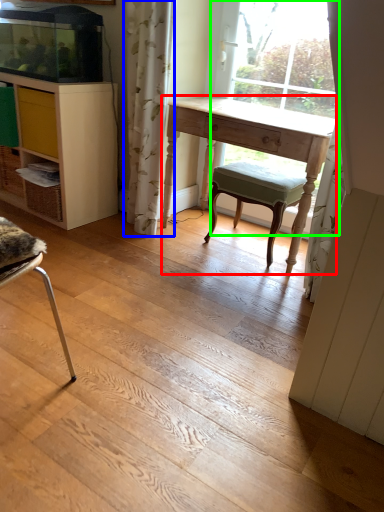
Question: Which object is the closest to the desk (highlighted by a red box)? Choose among these: curtain (highlighted by a blue box) or bay window (highlighted by a green box).

Choices:
 (A) curtain
 (B) bay window

Answer: (A)